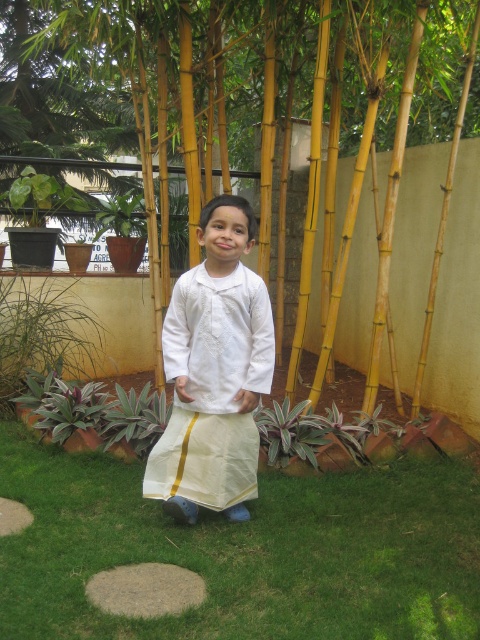
Question: Does yellow bamboo forest at center have a greater width compared to white cotton kurta at center?

Choices:
 (A) yes
 (B) no

Answer: (A)

Question: Which object is the closest to the white cotton kurta at center?

Choices:
 (A) yellow bamboo forest at center
 (B) green grass at center

Answer: (B)

Question: Can you confirm if yellow bamboo forest at center is smaller than white cotton kurta at center?

Choices:
 (A) no
 (B) yes

Answer: (A)

Question: Is green grass at center wider than white cotton kurta at center?

Choices:
 (A) yes
 (B) no

Answer: (A)

Question: Estimate the real-world distances between objects in this image. Which object is farther from the yellow bamboo forest at center?

Choices:
 (A) green grass at center
 (B) white cotton kurta at center

Answer: (A)

Question: Which object is positioned farthest from the green grass at center?

Choices:
 (A) white cotton kurta at center
 (B) yellow bamboo forest at center

Answer: (B)